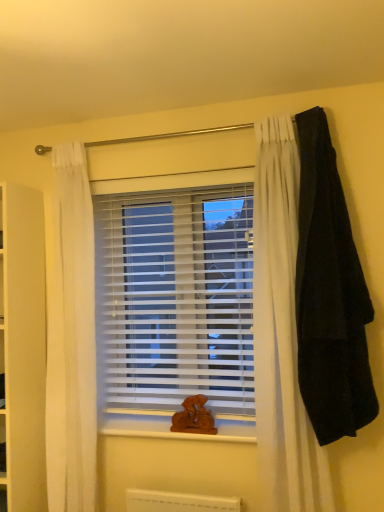
Identify the location of free space above wooden at center (from a real-world perspective). (167, 422).